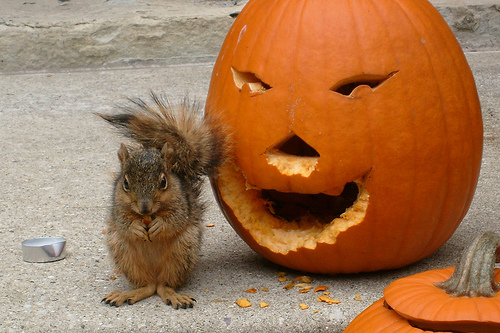
I want to click on dented candle, so 52,247.